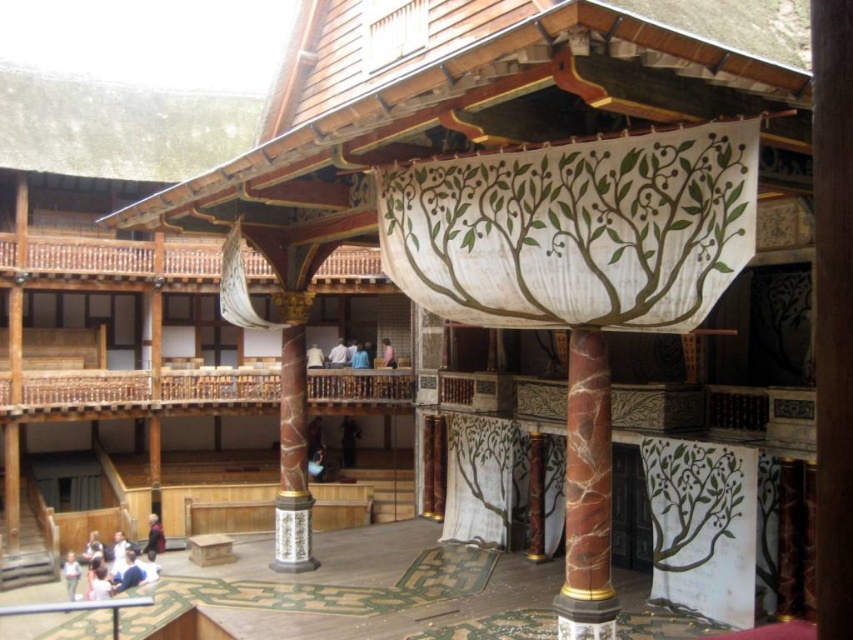
The width and height of the screenshot is (853, 640). What do you see at coordinates (109, 566) in the screenshot? I see `light pink fabric at lower left` at bounding box center [109, 566].

Does point (109, 582) come closer to viewer compared to point (389, 360)?

Yes.

Identify the location of light pink fabric at lower left. (109, 566).

Between light blue shirt at lower left and dark blue sweater at lower left, which one is positioned higher?

dark blue sweater at lower left

Which is behind, point (73, 593) or point (161, 534)?

The point (161, 534) is more distant.

You are a GUI agent. You are given a task and a screenshot of the screen. Output one action in this format:
    pyautogui.click(x=<x>, y=<y>)
    Task: Click on the light blue shirt at lower left
    The image size is (853, 640).
    Given the screenshot: What is the action you would take?
    pyautogui.click(x=70, y=573)

Does light blue shirt at lower left lie behind pink fabric at upper center?

That is False.

Between point (71, 582) and point (389, 358), which one is positioned in front?

Point (71, 582)

You are a GUI agent. You are given a task and a screenshot of the screen. Output one action in this format:
    pyautogui.click(x=<x>, y=<y>)
    Task: Click on the light blue shirt at lower left
    The image size is (853, 640).
    Given the screenshot: What is the action you would take?
    pyautogui.click(x=70, y=573)